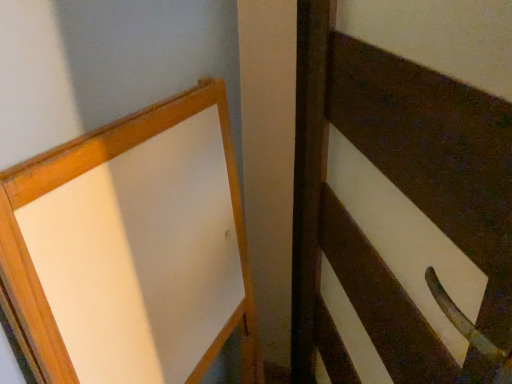
Where is `white matte barn door at right`? white matte barn door at right is located at coordinates (406, 196).

Describe the element at coordinates (406, 196) in the screenshot. I see `white matte barn door at right` at that location.

Identify the location of white matte barn door at right. (406, 196).